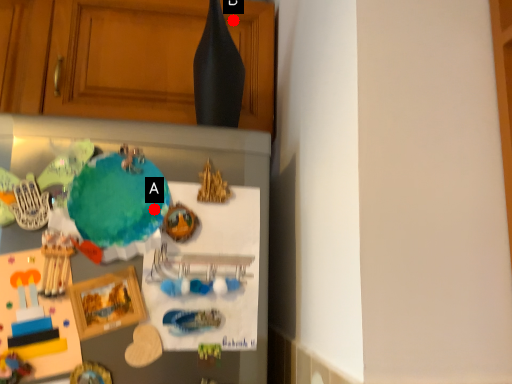
Question: Two points are circled on the image, labeled by A and B beside each circle. Which point is closer to the camera?

Choices:
 (A) A is closer
 (B) B is closer

Answer: (A)